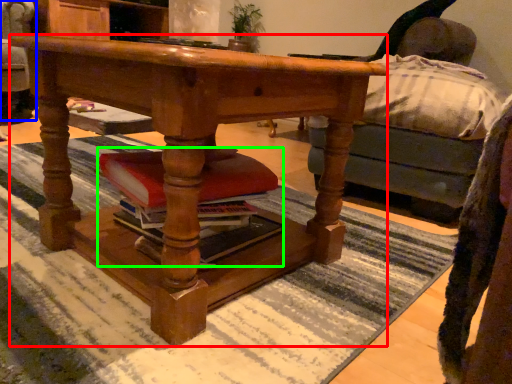
Question: Estimate the real-world distances between objects in this image. Which object is farther from desk (highlighted by a red box), swivel chair (highlighted by a blue box) or book (highlighted by a green box)?

Choices:
 (A) swivel chair
 (B) book

Answer: (A)